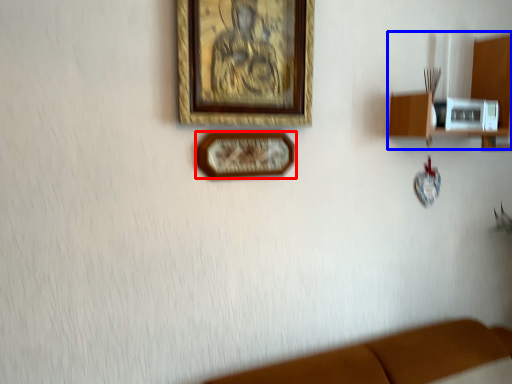
Question: Which point is closer to the camera, picture frame (highlighted by a red box) or shelf (highlighted by a blue box)?

Choices:
 (A) picture frame
 (B) shelf

Answer: (A)